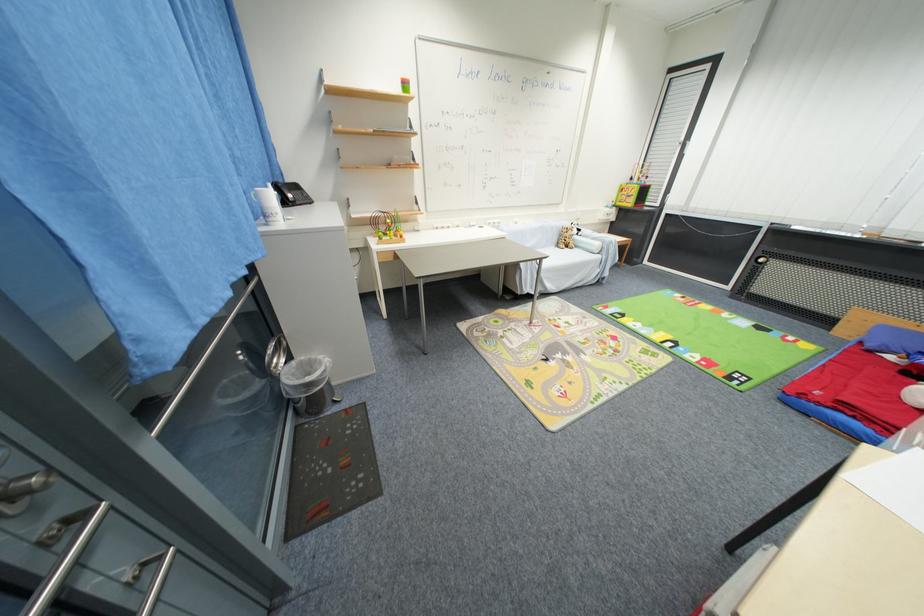
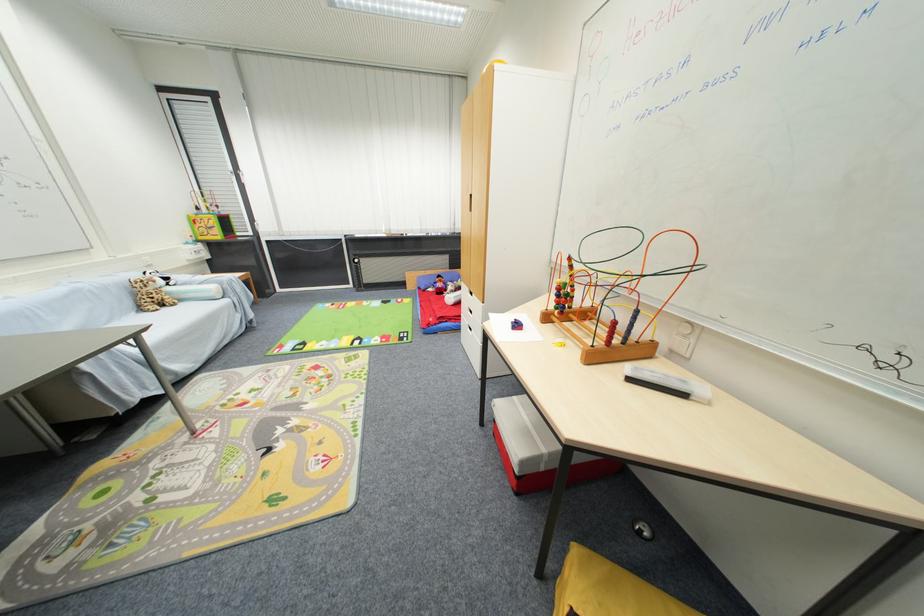
Locate, in the second image, the point that corresponds to (x=635, y=206) in the first image.

(223, 238)